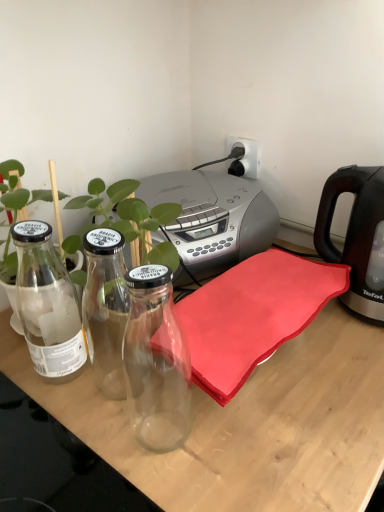
Question: Does point click(266, 440) appear closer or farther from the camera than point click(19, 203)?

Choices:
 (A) farther
 (B) closer

Answer: (B)

Question: Considering their positions, is transparent glass bottles at left located in front of or behind green leafy plant at left?

Choices:
 (A) behind
 (B) front

Answer: (B)

Question: Which is nearer to the black plastic kettle at right?

Choices:
 (A) white plastic electric outlet at upper center
 (B) green leafy plant at left
 (C) transparent glass bottles at left
 (D) clear glass plant at center

Answer: (C)

Question: Estimate the real-world distances between objects in this image. Which object is closer to the green leafy plant at left?

Choices:
 (A) black plastic kettle at right
 (B) white plastic electric outlet at upper center
 (C) transparent glass bottles at left
 (D) clear glass plant at center

Answer: (D)